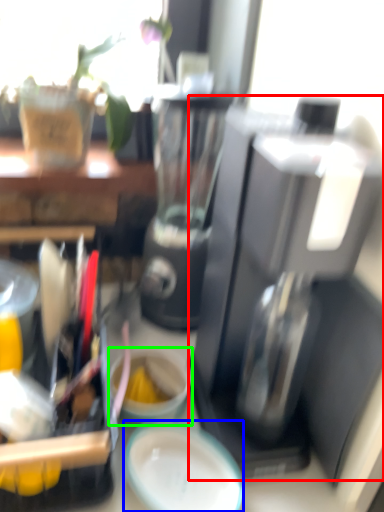
Question: Considering the real-world distances, which object is closest to coffee maker (highlighted by a red box)? plate (highlighted by a blue box) or coffee cup (highlighted by a green box).

Choices:
 (A) plate
 (B) coffee cup

Answer: (A)